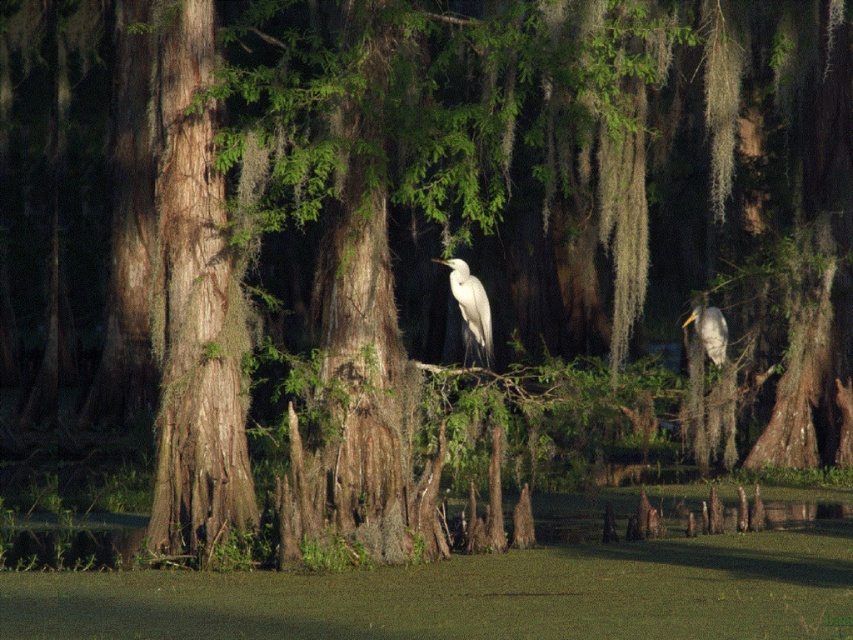
Does white smooth bird at center have a lesser width compared to white matte bird at right?

In fact, white smooth bird at center might be wider than white matte bird at right.

Between white smooth bird at center and white matte bird at right, which one is positioned higher?

white smooth bird at center is higher up.

Where is `white smooth bird at center`? white smooth bird at center is located at coordinates (471, 312).